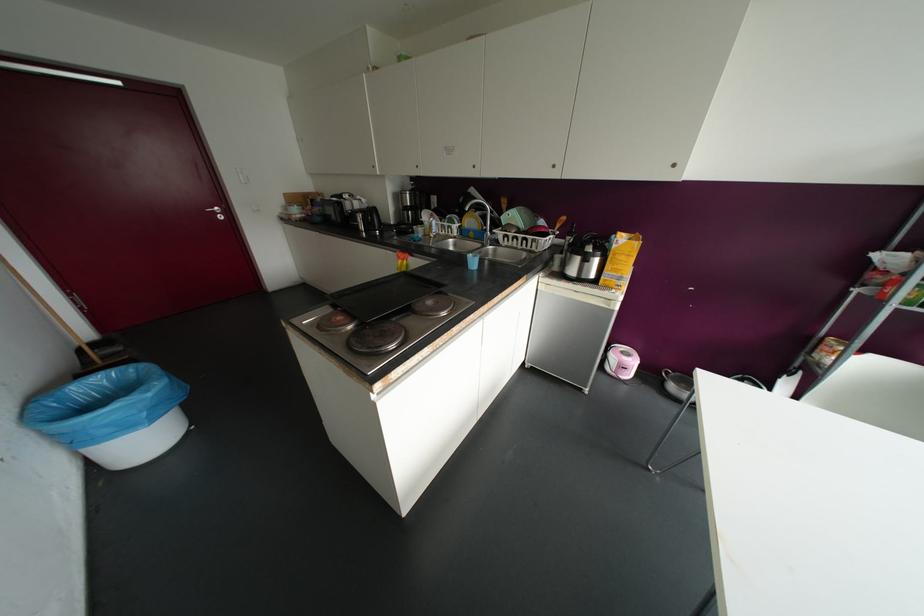
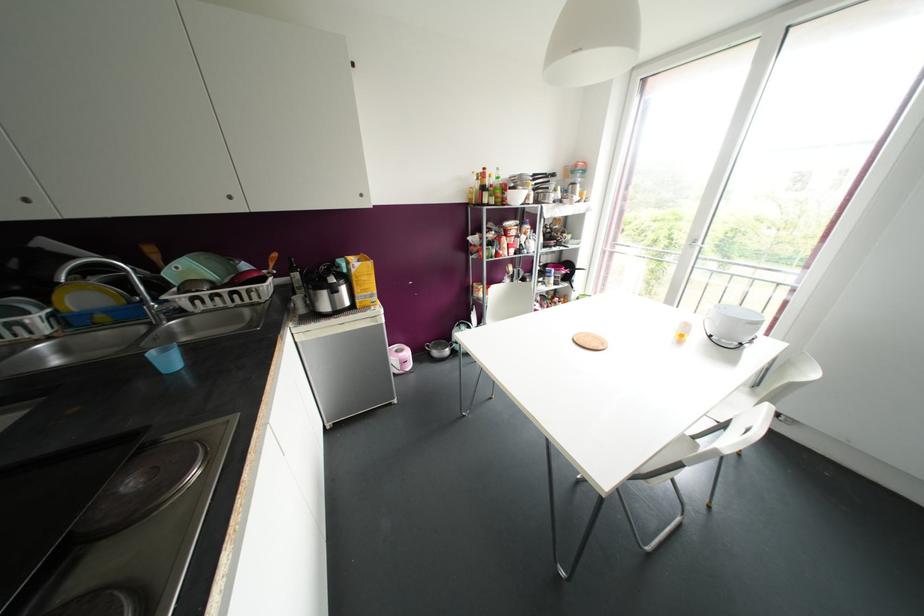
In the second image, find the point that corresponds to point (472, 262) in the first image.

(168, 361)